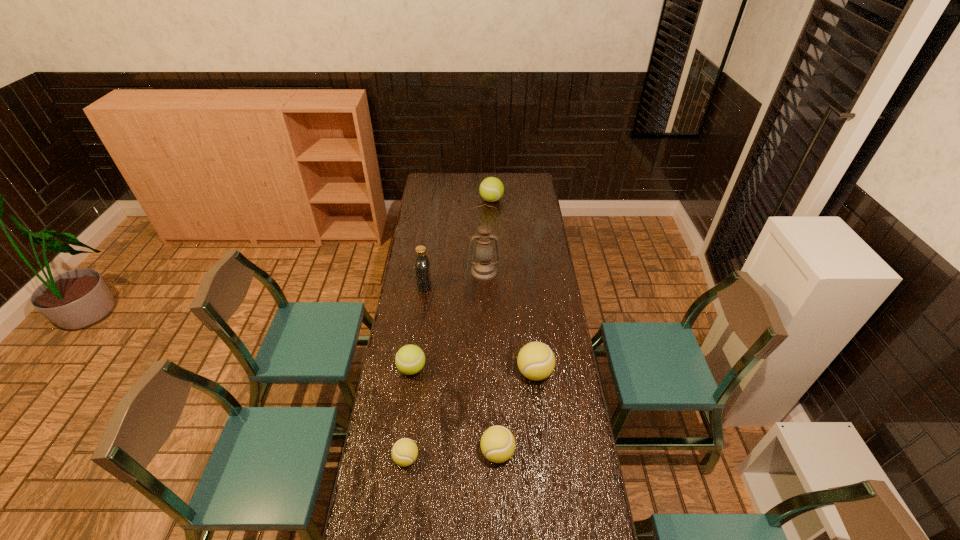
Identify the location of the shortest object. The height and width of the screenshot is (540, 960). (x=405, y=451).

The height and width of the screenshot is (540, 960). I want to click on the shortest tennis ball, so click(405, 451).

Identify the location of vacant position located on the back of the tallest object. (484, 222).

The width and height of the screenshot is (960, 540). In order to click on vacant position located on the front-facing side of the vodka in this screenshot , I will do `click(492, 285)`.

At what (x,y) coordinates should I click in order to perform the action: click on vacant area situated 0.200m on the front of the farthest yellow tennis ball. Please return your answer as a coordinate pair (x, y). The image size is (960, 540). Looking at the image, I should click on (541, 436).

You are a GUI agent. You are given a task and a screenshot of the screen. Output one action in this format:
    pyautogui.click(x=<x>, y=<y>)
    Task: Click on the free location located 0.280m on the front of the farthest object
    
    Given the screenshot: What is the action you would take?
    pyautogui.click(x=492, y=235)

Locate an element on the screen. The height and width of the screenshot is (540, 960). free location located 0.190m on the right of the second yellow tennis ball from left to right is located at coordinates (569, 453).

You are a GUI agent. You are given a task and a screenshot of the screen. Output one action in this format:
    pyautogui.click(x=<x>, y=<y>)
    Task: Click on the free space located on the right of the left green tennis ball
    This screenshot has width=960, height=540.
    Given the screenshot: What is the action you would take?
    pyautogui.click(x=500, y=368)

You are a GUI agent. You are given a task and a screenshot of the screen. Output one action in this format:
    pyautogui.click(x=<x>, y=<y>)
    Task: Click on the vacant space located 0.180m on the front of the shortest tennis ball
    
    Given the screenshot: What is the action you would take?
    pyautogui.click(x=397, y=530)

The image size is (960, 540). In order to click on vodka that is at the left edge in this screenshot , I will do `click(422, 265)`.